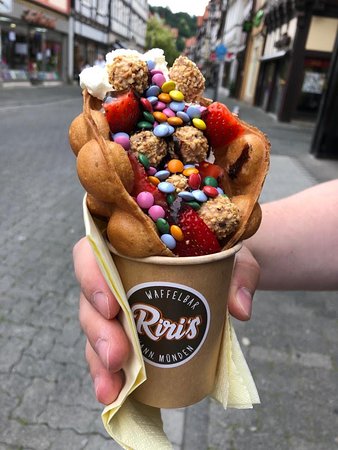
The width and height of the screenshot is (338, 450). Find the location of `napkin`. napkin is located at coordinates (229, 377).